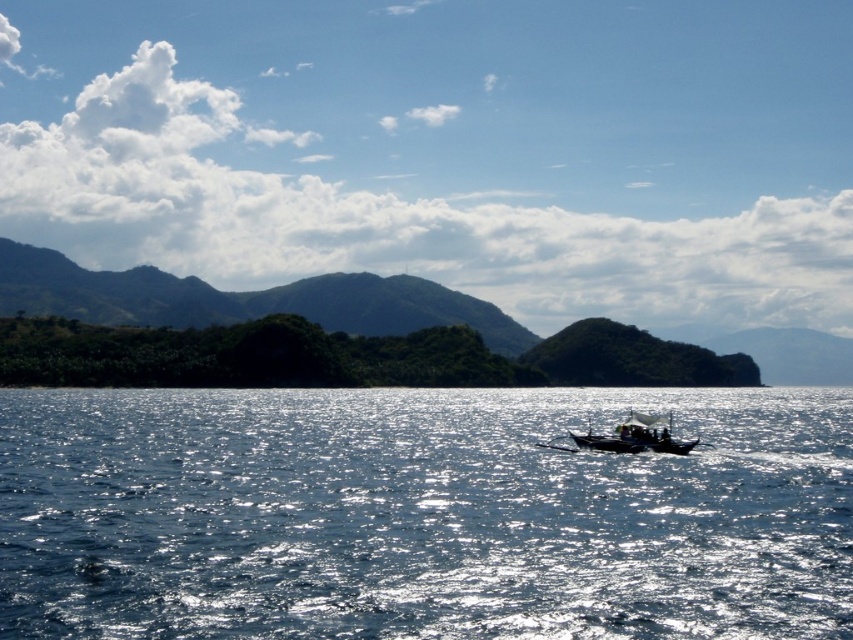
Which is below, glistening blue water at center or black wooden boat at center?

glistening blue water at center

Between glistening blue water at center and black wooden boat at center, which one has more height?

With more height is glistening blue water at center.

Between point (503, 470) and point (666, 445), which one is positioned behind?

Point (666, 445)

The image size is (853, 640). I want to click on glistening blue water at center, so click(x=421, y=515).

Who is positioned more to the right, glistening blue water at center or green leafy mountain at left?

green leafy mountain at left is more to the right.

Can you confirm if glistening blue water at center is taller than green leafy mountain at left?

No, glistening blue water at center is not taller than green leafy mountain at left.

What are the coordinates of `glistening blue water at center` in the screenshot? It's located at (421, 515).

This screenshot has height=640, width=853. Identify the location of glistening blue water at center. (421, 515).

Who is higher up, green leafy mountain at left or black wooden boat at center?

green leafy mountain at left

Can you confirm if green leafy mountain at left is shorter than black wooden boat at center?

No.

Is point (56, 284) behind point (630, 432)?

Yes, it is.

This screenshot has width=853, height=640. What are the coordinates of `green leafy mountain at left` in the screenshot? It's located at (242, 300).